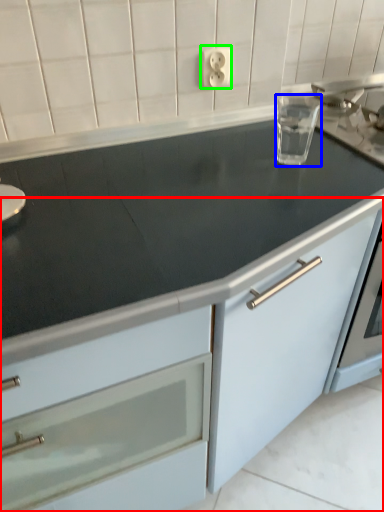
Question: Considering the real-world distances, which object is closest to cabinetry (highlighted by a red box)? appliance (highlighted by a blue box) or electric outlet (highlighted by a green box).

Choices:
 (A) appliance
 (B) electric outlet

Answer: (A)